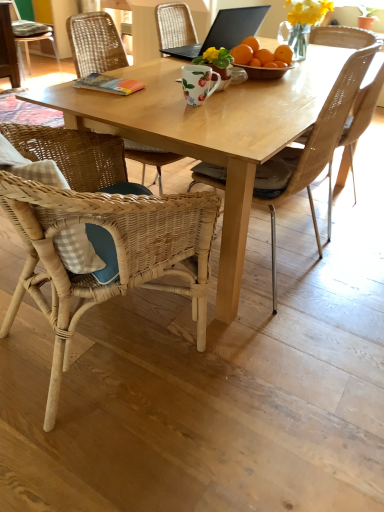
The height and width of the screenshot is (512, 384). What are the coordinates of `free space that is to the left of floral matte coffee cup at center` in the screenshot? It's located at (156, 99).